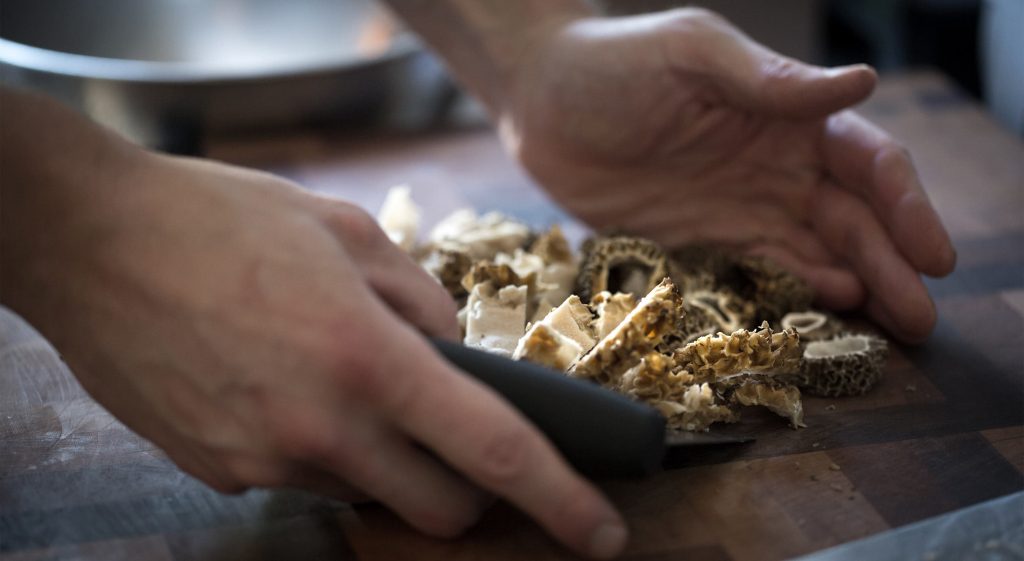
Where is `stainless steel multipurpose griddle scraper`? This screenshot has width=1024, height=561. stainless steel multipurpose griddle scraper is located at coordinates (679, 440), (543, 393).